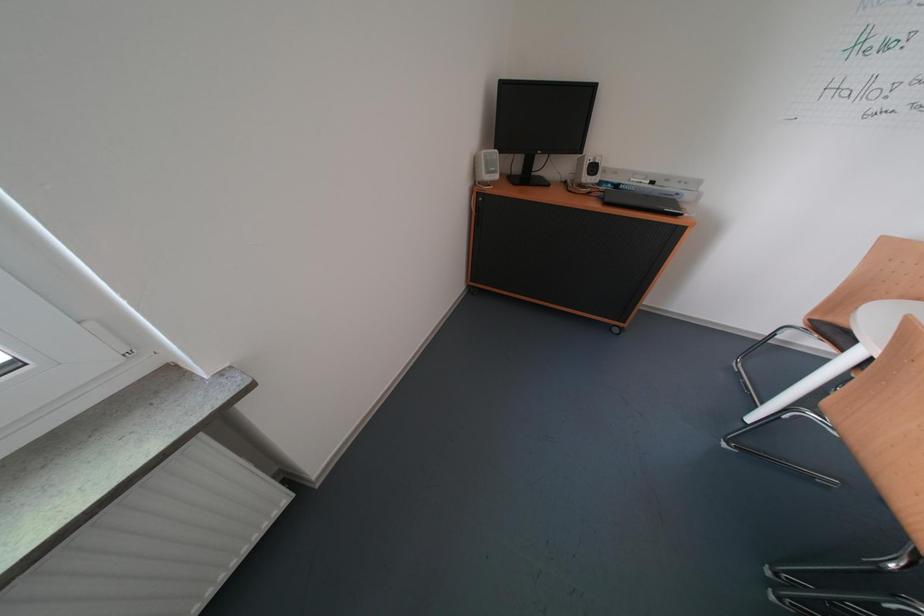
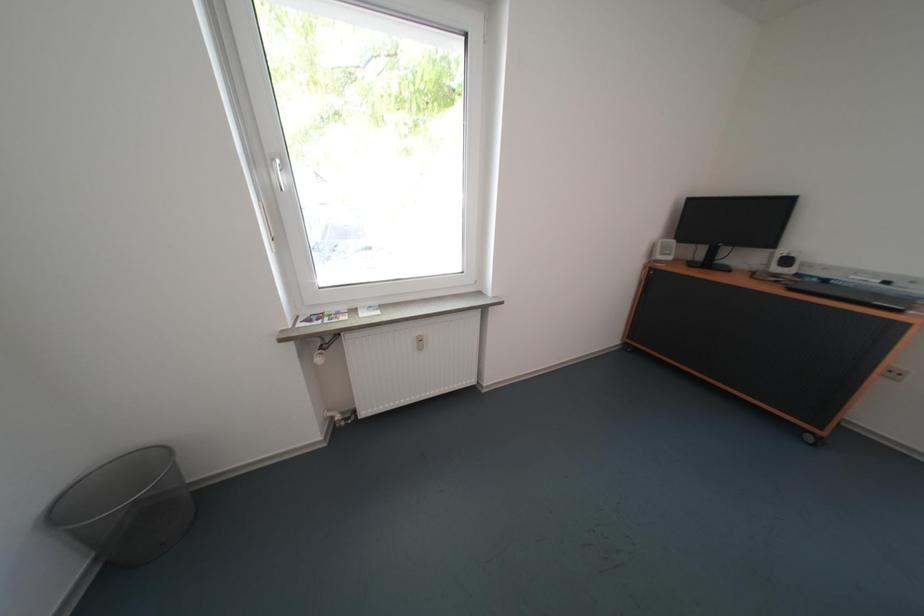
Question: The camera is either moving clockwise (left) or counter-clockwise (right) around the object. The first image is from the beginning of the video and the second image is from the end. Is the camera moving left or right when shooting the video?

Choices:
 (A) Left
 (B) Right

Answer: (B)